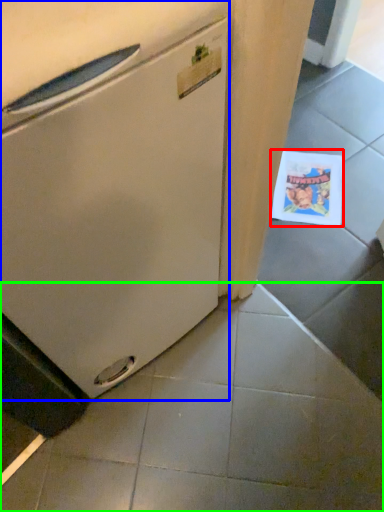
Question: Which object is the closest to the postcard (highlighted by a red box)? Choose among these: refrigerator (highlighted by a blue box) or tile (highlighted by a green box).

Choices:
 (A) refrigerator
 (B) tile

Answer: (B)